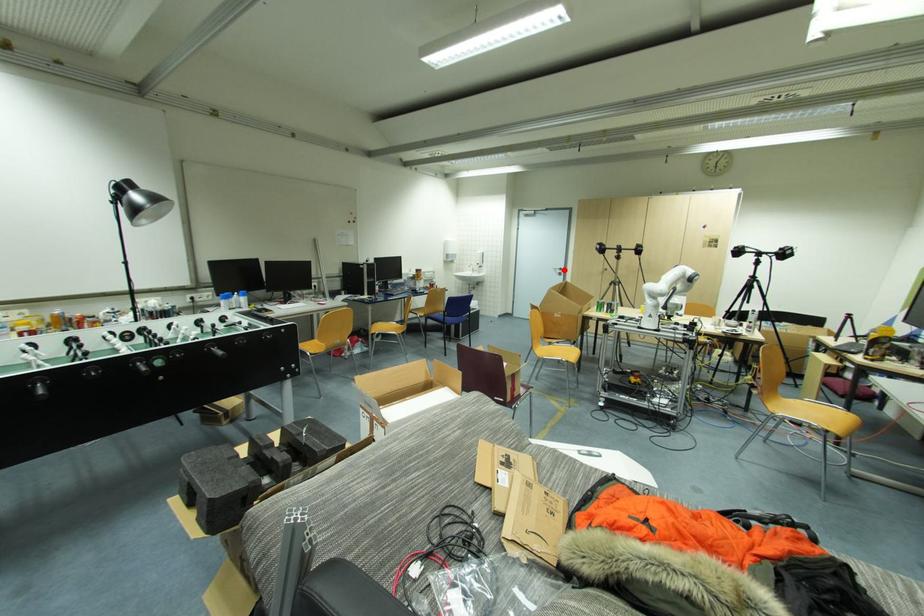
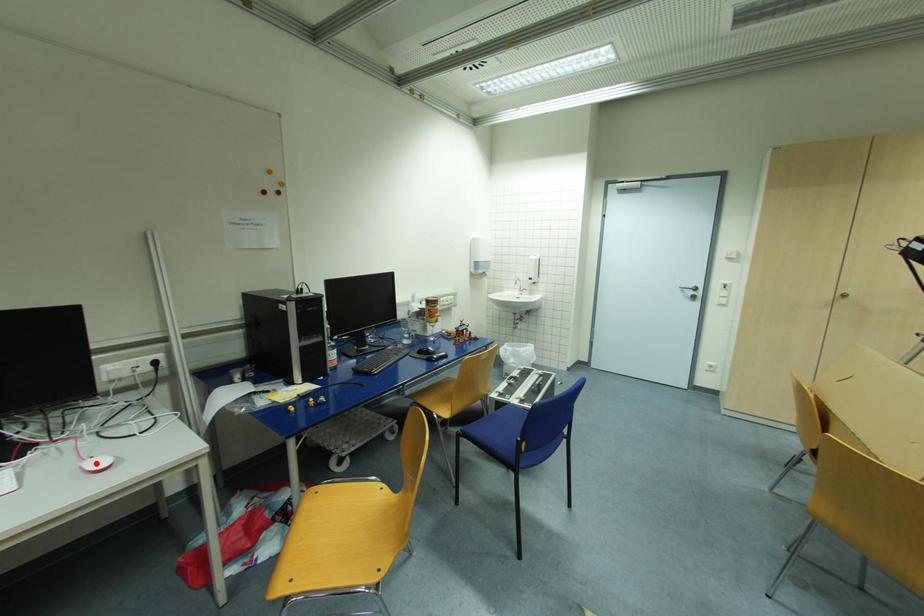
I am providing you with two images of the same scene from different viewpoints. A red point is marked on the first image and another point is marked on the second image. Are the points marked in image1 and image2 representing the same 3D position?

No